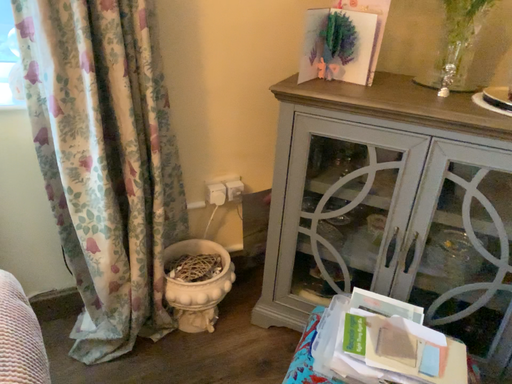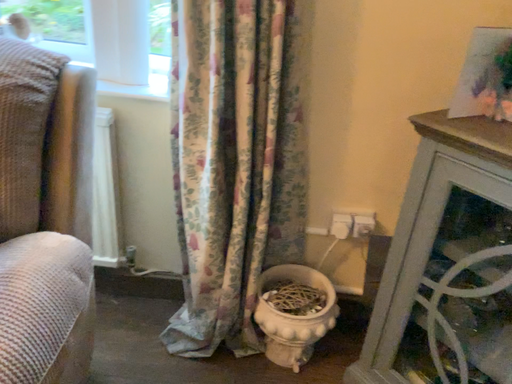
Question: How did the camera likely rotate when shooting the video?

Choices:
 (A) rotated left
 (B) rotated right

Answer: (A)